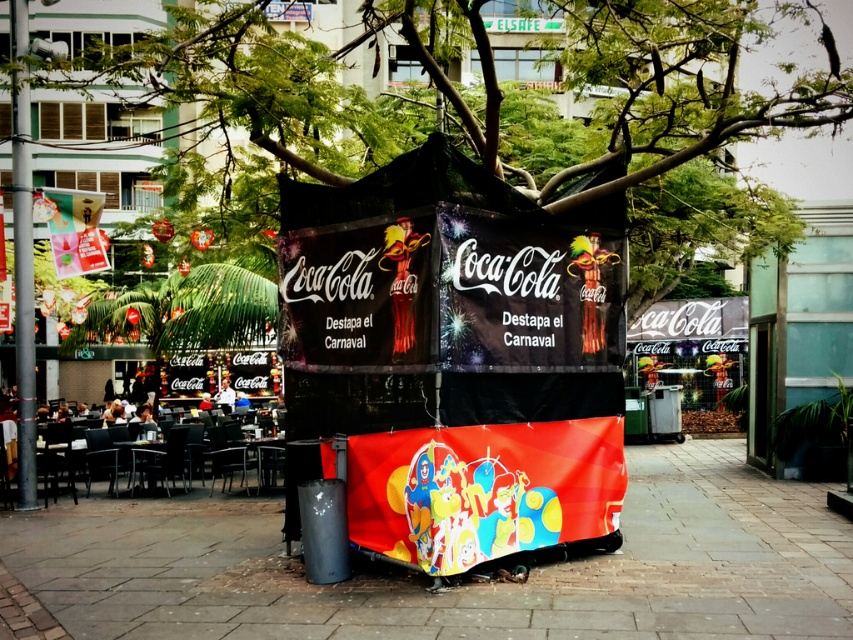
Question: Among these objects, which one is nearest to the camera?

Choices:
 (A) brick pavement at center
 (B) black metal pole at left

Answer: (A)

Question: Does brick pavement at center appear under black metal pole at left?

Choices:
 (A) no
 (B) yes

Answer: (B)

Question: Which object appears farthest from the camera in this image?

Choices:
 (A) brick pavement at center
 (B) black metal pole at left

Answer: (B)

Question: Can you confirm if brick pavement at center is bigger than black metal pole at left?

Choices:
 (A) yes
 (B) no

Answer: (A)

Question: Can you confirm if brick pavement at center is positioned below black metal pole at left?

Choices:
 (A) no
 (B) yes

Answer: (B)